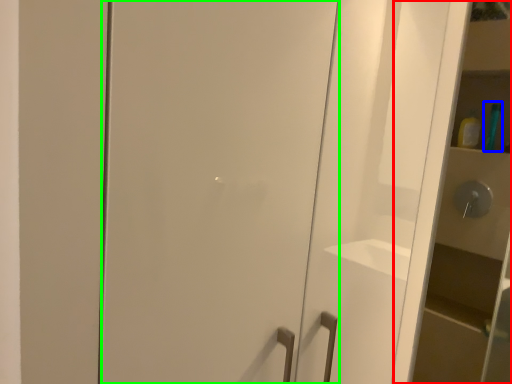
Question: Considering the real-world distances, which object is closest to cabinetry (highlighted by a red box)? toiletry (highlighted by a blue box) or door (highlighted by a green box).

Choices:
 (A) toiletry
 (B) door

Answer: (A)